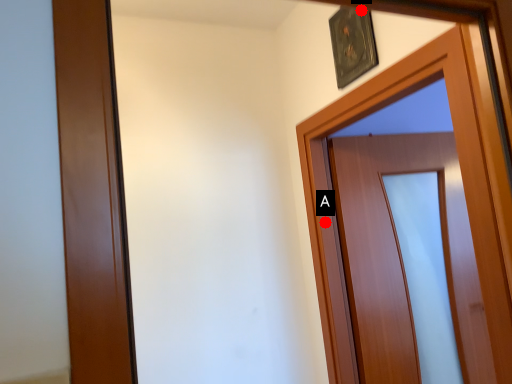
Question: Two points are circled on the image, labeled by A and B beside each circle. Which point is closer to the camera taking this photo?

Choices:
 (A) A is closer
 (B) B is closer

Answer: (B)